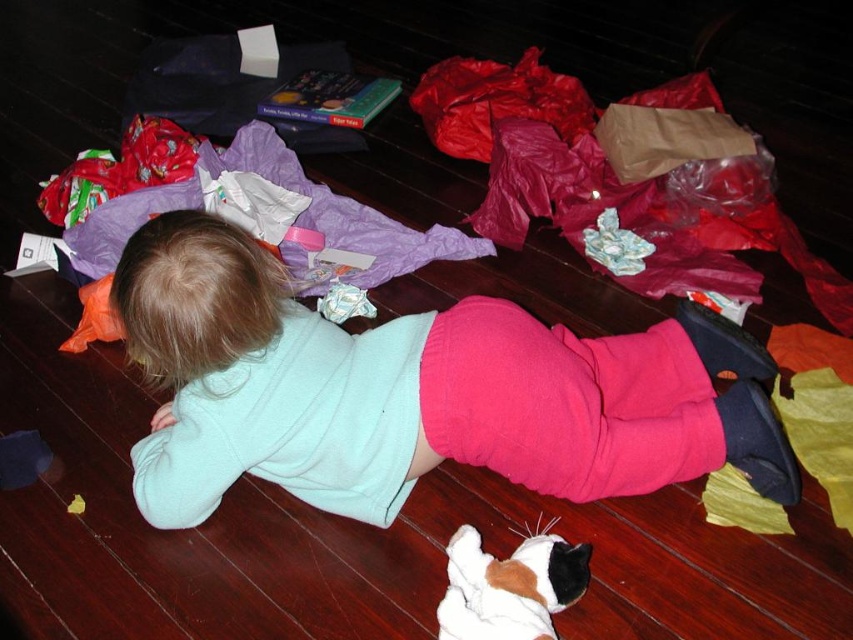
Question: Can you confirm if light blue fleece at center is positioned above white plush cat at lower center?

Choices:
 (A) yes
 (B) no

Answer: (A)

Question: In this image, where is light blue fleece at center located relative to white plush cat at lower center?

Choices:
 (A) above
 (B) below

Answer: (A)

Question: Is light blue fleece at center positioned at the back of white plush cat at lower center?

Choices:
 (A) no
 (B) yes

Answer: (A)

Question: Among these points, which one is nearest to the camera?

Choices:
 (A) (456, 634)
 (B) (442, 355)

Answer: (A)